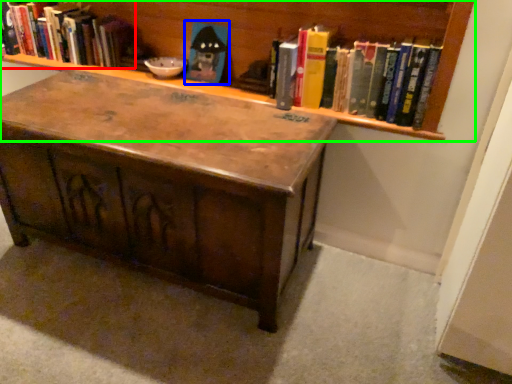
Question: Based on their relative distances, which object is farther from book (highlighted by a red box)? Choose from toy (highlighted by a blue box) and bookcase (highlighted by a green box).

Choices:
 (A) toy
 (B) bookcase

Answer: (A)